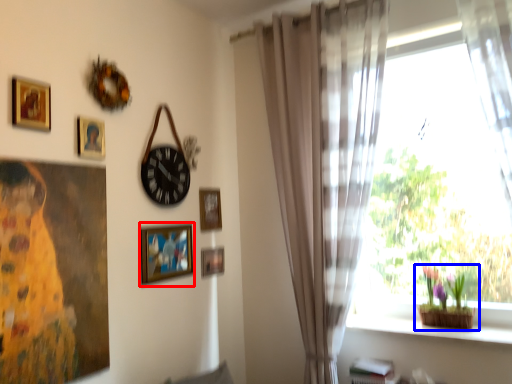
Question: Which point is closer to the camera, picture frame (highlighted by a red box) or houseplant (highlighted by a blue box)?

Choices:
 (A) picture frame
 (B) houseplant

Answer: (A)